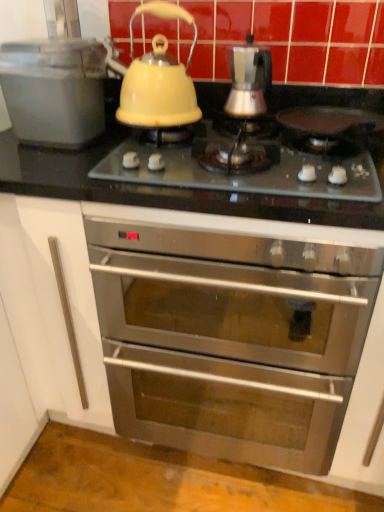
Question: Is matte plastic container at left, placed as the 2th kitchen appliance when sorted from right to left, further to the viewer compared to satin silver coffee maker at center, which ranks as the 1th kitchen appliance in right-to-left order?

Choices:
 (A) yes
 (B) no

Answer: (B)

Question: Are matte plastic container at left, placed as the 2th kitchen appliance when sorted from right to left, and satin silver coffee maker at center, positioned as the 2th kitchen appliance in left-to-right order, far apart?

Choices:
 (A) no
 (B) yes

Answer: (A)

Question: Is matte plastic container at left, placed as the 1th kitchen appliance when sorted from left to right, thinner than satin silver coffee maker at center, which ranks as the 1th kitchen appliance in right-to-left order?

Choices:
 (A) yes
 (B) no

Answer: (B)

Question: Is matte plastic container at left, placed as the 1th kitchen appliance when sorted from left to right, positioned beyond the bounds of satin silver coffee maker at center, which ranks as the 1th kitchen appliance in right-to-left order?

Choices:
 (A) yes
 (B) no

Answer: (A)

Question: Could you tell me if matte plastic container at left, placed as the 1th kitchen appliance when sorted from left to right, is facing satin silver coffee maker at center, which ranks as the 1th kitchen appliance in right-to-left order?

Choices:
 (A) yes
 (B) no

Answer: (B)

Question: In terms of size, does matte glass cooktop at center appear bigger or smaller than stainless steel oven at center?

Choices:
 (A) big
 (B) small

Answer: (B)

Question: Which is correct: matte glass cooktop at center is inside stainless steel oven at center, or outside of it?

Choices:
 (A) inside
 (B) outside

Answer: (B)

Question: Considering the positions of point tap(362, 181) and point tap(182, 324), is point tap(362, 181) closer or farther from the camera than point tap(182, 324)?

Choices:
 (A) closer
 (B) farther

Answer: (A)

Question: Is matte glass cooktop at center in front of or behind stainless steel oven at center in the image?

Choices:
 (A) behind
 (B) front

Answer: (A)

Question: Looking at their shapes, would you say yellow glossy kettle at upper center is wider or thinner than satin silver coffee maker at center, which ranks as the 1th kitchen appliance in right-to-left order?

Choices:
 (A) thin
 (B) wide

Answer: (B)

Question: In terms of height, does yellow glossy kettle at upper center look taller or shorter compared to satin silver coffee maker at center, which ranks as the 1th kitchen appliance in right-to-left order?

Choices:
 (A) tall
 (B) short

Answer: (A)

Question: Considering the positions of yellow glossy kettle at upper center and satin silver coffee maker at center, positioned as the 2th kitchen appliance in left-to-right order, in the image, is yellow glossy kettle at upper center bigger or smaller than satin silver coffee maker at center, positioned as the 2th kitchen appliance in left-to-right order,?

Choices:
 (A) small
 (B) big

Answer: (B)

Question: From the image's perspective, relative to satin silver coffee maker at center, positioned as the 2th kitchen appliance in left-to-right order, is yellow glossy kettle at upper center above or below?

Choices:
 (A) below
 (B) above

Answer: (B)

Question: Is satin silver coffee maker at center, which ranks as the 1th kitchen appliance in right-to-left order, taller or shorter than matte plastic container at left, placed as the 2th kitchen appliance when sorted from right to left?

Choices:
 (A) short
 (B) tall

Answer: (A)

Question: From the image's perspective, is satin silver coffee maker at center, which ranks as the 1th kitchen appliance in right-to-left order, located above or below matte plastic container at left, placed as the 2th kitchen appliance when sorted from right to left?

Choices:
 (A) above
 (B) below

Answer: (A)